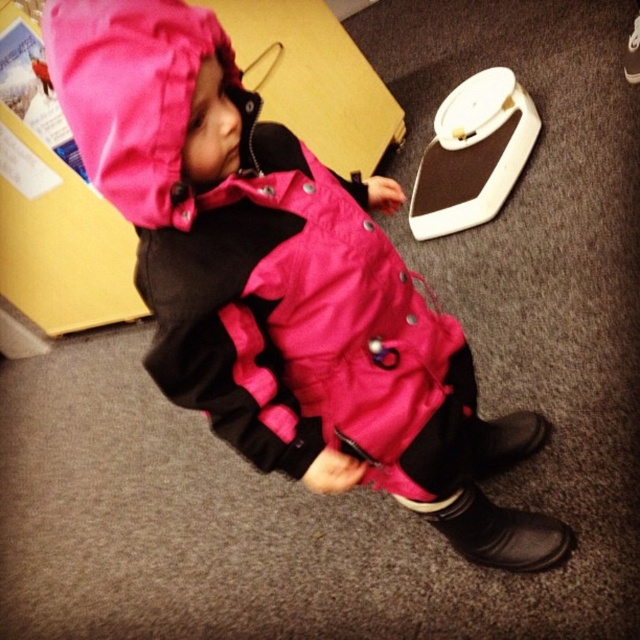
Question: Is matte pink snowsuit at center below white matte scale at upper center?

Choices:
 (A) yes
 (B) no

Answer: (A)

Question: Considering the relative positions of white matte scale at upper center and black leather boot at lower right in the image provided, where is white matte scale at upper center located with respect to black leather boot at lower right?

Choices:
 (A) above
 (B) below

Answer: (A)

Question: Which point appears closest to the camera in this image?

Choices:
 (A) (156, 120)
 (B) (448, 179)
 (C) (531, 561)

Answer: (A)

Question: Which point is farther from the camera taking this photo?

Choices:
 (A) (285, 186)
 (B) (464, 540)
 (C) (438, 204)

Answer: (C)

Question: Does matte pink snowsuit at center appear on the left side of black leather boot at lower right?

Choices:
 (A) no
 (B) yes

Answer: (B)

Question: Which of the following is the closest to the observer?

Choices:
 (A) (189, 72)
 (B) (464, 109)
 (C) (444, 532)

Answer: (A)